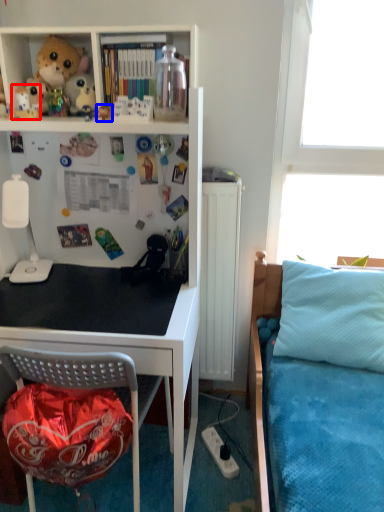
Question: Which of the following is the farthest to the observer, toy (highlighted by a red box) or toy (highlighted by a blue box)?

Choices:
 (A) toy
 (B) toy

Answer: (A)